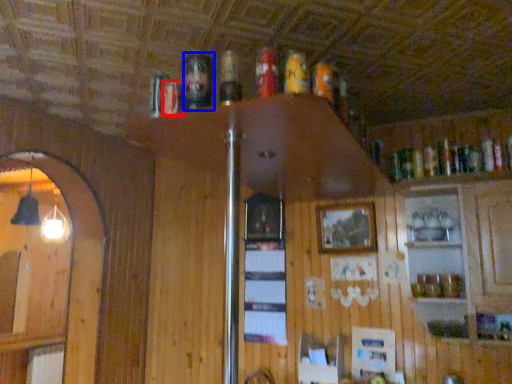
Question: Which of the following is the closest to the observer, beer (highlighted by a red box) or beer (highlighted by a blue box)?

Choices:
 (A) beer
 (B) beer

Answer: (B)